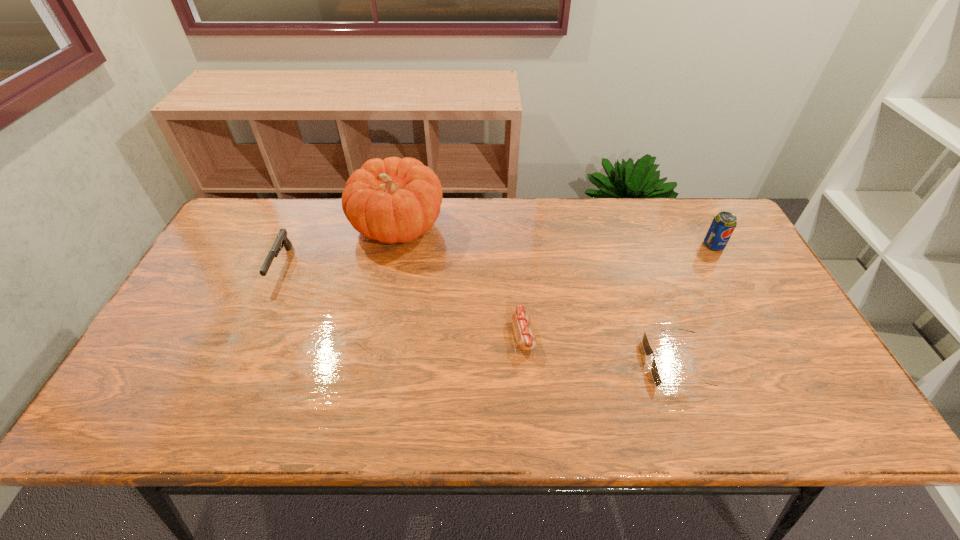
Locate an element on the screen. Image resolution: width=960 pixels, height=540 pixels. free space located 0.260m on the front of the tallest object is located at coordinates (377, 328).

This screenshot has height=540, width=960. What are the coordinates of `vacant space located 0.090m on the left of the soda` in the screenshot? It's located at (674, 245).

Locate an element on the screen. The image size is (960, 540). vacant region located at the muzzle end of the third tallest object is located at coordinates 244,350.

At what (x,y) coordinates should I click in order to perform the action: click on vacant area situated on the left of the sausage. Please return your answer as a coordinate pair (x, y). Looking at the image, I should click on (476, 335).

At what (x,y) coordinates should I click in order to perform the action: click on vacant space located 0.180m on the front-facing side of the second object from right to left. Please return your answer as a coordinate pair (x, y). The height and width of the screenshot is (540, 960). Looking at the image, I should click on (572, 364).

Identify the location of vacant space positioned on the front-facing side of the second object from right to left. (627, 364).

Where is `vacant region located on the front-facing side of the second object from right to left`? This screenshot has width=960, height=540. vacant region located on the front-facing side of the second object from right to left is located at coordinates (531, 364).

At what (x,y) coordinates should I click in order to perform the action: click on pumpkin that is positioned at the far edge. Please return your answer as a coordinate pair (x, y). This screenshot has height=540, width=960. Looking at the image, I should click on (393, 200).

Locate an element on the screen. soda that is positioned at the far edge is located at coordinates (723, 224).

What are the coordinates of `gun situated at the far edge` in the screenshot? It's located at (281, 238).